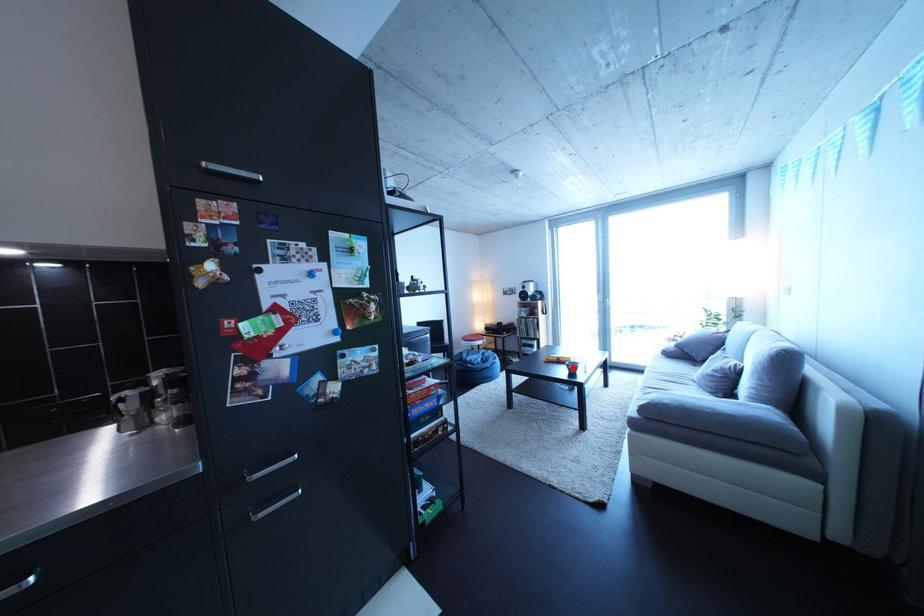
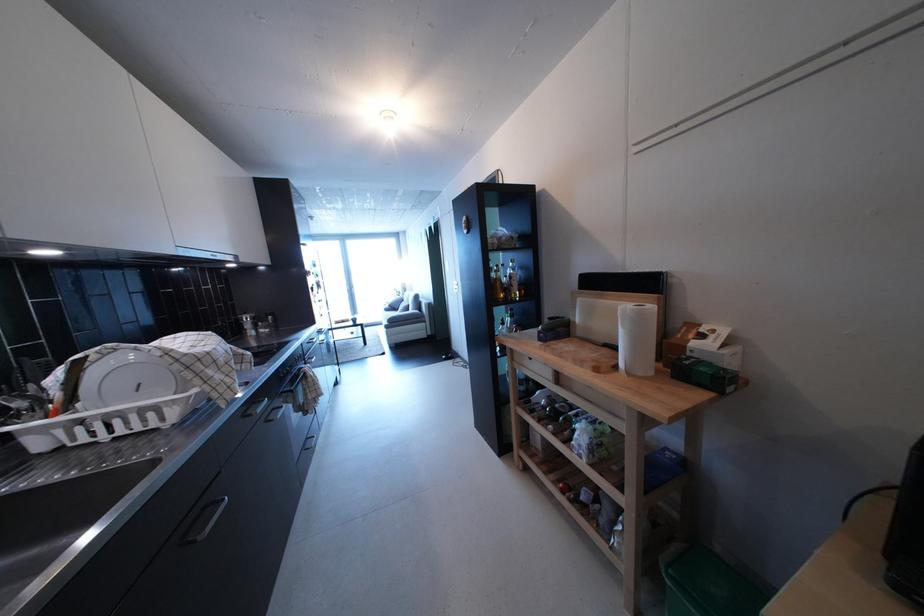
Question: I am providing you with two images of the same scene from different viewpoints. A red point is marked on the first image. Can you still see the location of the red point in image 2?

Choices:
 (A) Yes
 (B) No

Answer: (B)